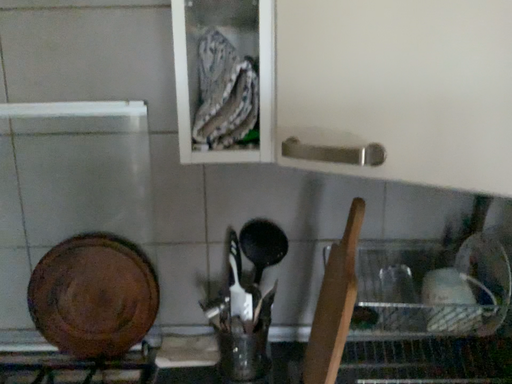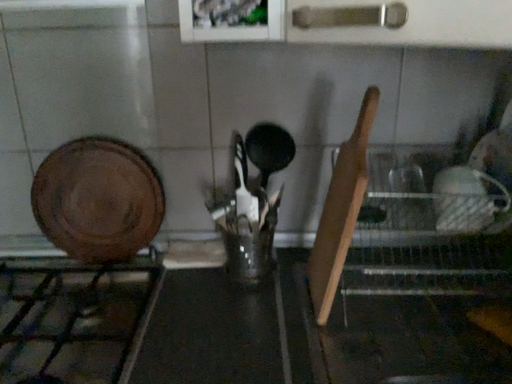
Question: How did the camera likely rotate when shooting the video?

Choices:
 (A) rotated upward
 (B) rotated downward

Answer: (B)